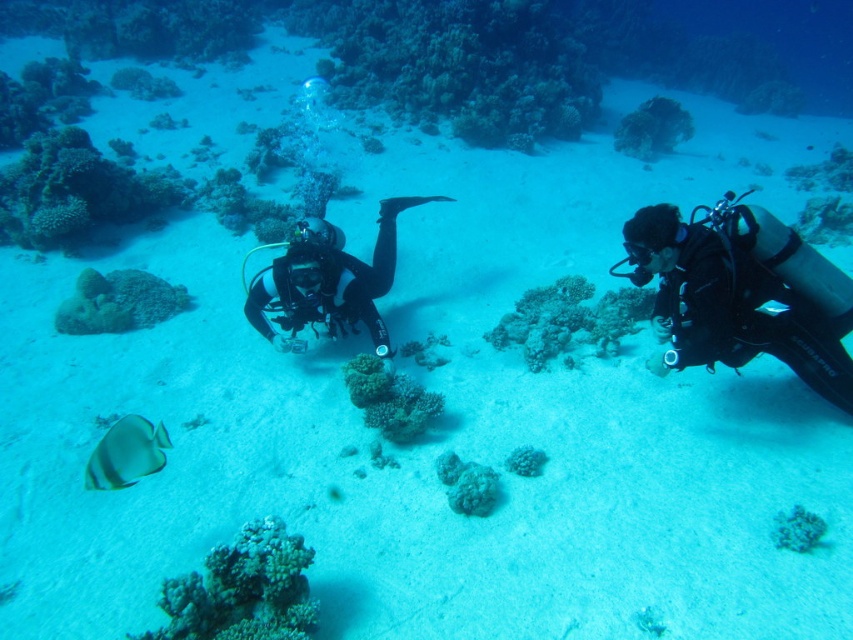
You are a marine biologist observing underwater life. You notice the black matte scuba diver at right and the green matte coral at center. Which object is positioned lower in the water?

The black matte scuba diver at right is below the green matte coral at center, so it is positioned lower in the water.

You are an underwater photographer planning to capture a photo of the smooth coral at center and the green coral at center. Since you want to highlight their height differences, which coral should you position closer to the camera to emphasize its height?

To emphasize the height difference between the smooth coral at center and the green coral at center, position the smooth coral at center closer to the camera since it is taller than the green coral at center.

You are a marine biologist observing underwater life. You notice the black matte scuba diver at right and the green matte coral at center. Which object is positioned to the right of the other?

The black matte scuba diver at right is to the right of the green matte coral at center.